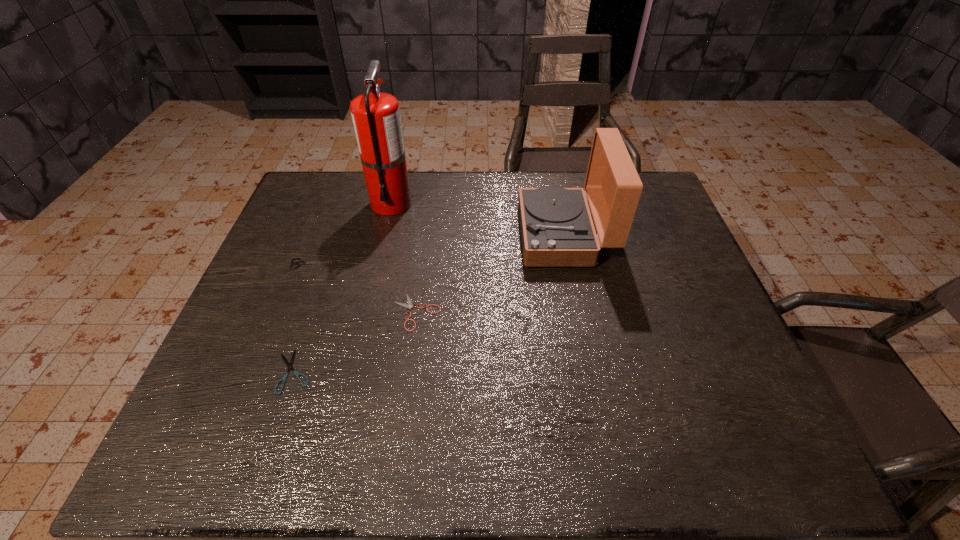
Find the location of `the tallest object`. the tallest object is located at coordinates (376, 118).

What are the coordinates of `the rightmost object` in the screenshot? It's located at (557, 230).

In order to click on phonograph record in this screenshot , I will do `click(557, 230)`.

The image size is (960, 540). I want to click on the third shortest object, so click(x=300, y=262).

I want to click on the tallest shears, so click(x=300, y=262).

Find the location of `the second nearest shears`. the second nearest shears is located at coordinates (409, 305).

The height and width of the screenshot is (540, 960). I want to click on the fourth farthest object, so click(409, 305).

The image size is (960, 540). Identify the location of the nearest object. (296, 373).

Where is `free space located 0.230m at the nozzle of the fire extinguisher`? This screenshot has width=960, height=540. free space located 0.230m at the nozzle of the fire extinguisher is located at coordinates (374, 277).

Identify the location of free space located 0.210m on the face of the phonograph record. (447, 235).